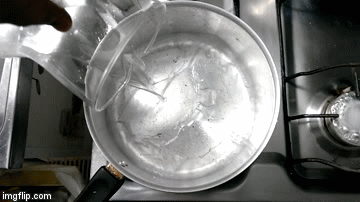
The height and width of the screenshot is (202, 360). Find the location of `cooking cutleries`. cooking cutleries is located at coordinates (231, 132), (41, 37), (40, 62), (36, 86).